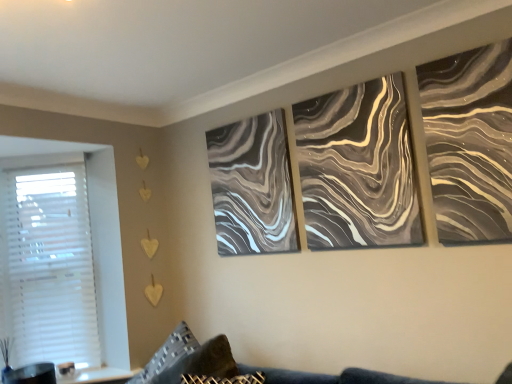
You are a GUI agent. You are given a task and a screenshot of the screen. Output one action in this format:
    pyautogui.click(x=<x>, y=<y>)
    Task: Click on the white plastic blinds at left
    
    Given the screenshot: What is the action you would take?
    pyautogui.click(x=48, y=265)

This screenshot has height=384, width=512. What do you see at coordinates (48, 265) in the screenshot?
I see `white plastic blinds at left` at bounding box center [48, 265].

Describe the element at coordinates (238, 366) in the screenshot. This screenshot has height=384, width=512. I see `velvet dark blue couch at lower center` at that location.

This screenshot has height=384, width=512. Describe the element at coordinates (470, 143) in the screenshot. I see `metallic silver abstract art at upper right` at that location.

This screenshot has width=512, height=384. I want to click on marble-like gray painting at center, which is the 1th canvas from back to front, so click(252, 187).

Considering the sizes of velvet dark blue couch at lower center and textured gray pillow at lower left in the image, is velvet dark blue couch at lower center wider or thinner than textured gray pillow at lower left?

Clearly, velvet dark blue couch at lower center has more width compared to textured gray pillow at lower left.

Between velvet dark blue couch at lower center and textured gray pillow at lower left, which one has smaller size?

textured gray pillow at lower left is smaller.

From the image's perspective, would you say velvet dark blue couch at lower center is positioned over textured gray pillow at lower left?

No, from the image's perspective, velvet dark blue couch at lower center is not above textured gray pillow at lower left.

Is point (507, 377) positioned after point (185, 348)?

No, (507, 377) is in front of (185, 348).

Who is shorter, metallic swirl canvas at center, the 2th canvas from the back, or textured gray pillow at lower left?

textured gray pillow at lower left.

From a real-world perspective, which is physically below, metallic swirl canvas at center, the 2th canvas from the back, or textured gray pillow at lower left?

textured gray pillow at lower left is physically lower.

Considering the positions of objects metallic swirl canvas at center, the second canvas positioned from the left, and textured gray pillow at lower left in the image provided, who is more to the right, metallic swirl canvas at center, the second canvas positioned from the left, or textured gray pillow at lower left?

metallic swirl canvas at center, the second canvas positioned from the left.

Could you measure the distance between metallic swirl canvas at center, the second canvas positioned from the left, and textured gray pillow at lower left?

The distance of metallic swirl canvas at center, the second canvas positioned from the left, from textured gray pillow at lower left is 1.30 meters.

Considering the relative positions of white plastic blinds at left and velvet dark blue couch at lower center in the image provided, is white plastic blinds at left to the left or to the right of velvet dark blue couch at lower center?

In the image, white plastic blinds at left appears on the left side of velvet dark blue couch at lower center.

Is white plastic blinds at left placed right next to velvet dark blue couch at lower center?

No, white plastic blinds at left is not with velvet dark blue couch at lower center.

Between white plastic blinds at left and velvet dark blue couch at lower center, which one has smaller width?

Thinner between the two is white plastic blinds at left.

Which is more to the left, velvet dark blue couch at lower center or white plastic blinds at left?

white plastic blinds at left is more to the left.

Between velvet dark blue couch at lower center and white plastic blinds at left, which one has larger width?

velvet dark blue couch at lower center.

Which object is further away from the camera taking this photo, velvet dark blue couch at lower center or white plastic blinds at left?

white plastic blinds at left.

Can you confirm if velvet dark blue couch at lower center is taller than white plastic blinds at left?

Incorrect, the height of velvet dark blue couch at lower center is not larger of that of white plastic blinds at left.

Who is more distant, white plastic blinds at left or marble-like gray painting at center, marked as the 2th canvas in a front-to-back arrangement?

white plastic blinds at left is behind.

Could marble-like gray painting at center, which is the 1th canvas from back to front, be considered to be inside white plastic blinds at left?

That's incorrect, marble-like gray painting at center, which is the 1th canvas from back to front, is not inside white plastic blinds at left.

Is white plastic blinds at left facing away from marble-like gray painting at center, which is the 1th canvas from back to front?

No, marble-like gray painting at center, which is the 1th canvas from back to front, is not at the back of white plastic blinds at left.

From the image's perspective, is white plastic blinds at left below marble-like gray painting at center, marked as the 2th canvas in a front-to-back arrangement?

Indeed, from the image's perspective, white plastic blinds at left is shown beneath marble-like gray painting at center, marked as the 2th canvas in a front-to-back arrangement.

In the image, there is a white plastic blinds at left. Where is `pillow below it (from a real-world perspective)`? Image resolution: width=512 pixels, height=384 pixels. pillow below it (from a real-world perspective) is located at coordinates (168, 354).

From the picture: Is textured gray pillow at lower left directly adjacent to white plastic blinds at left?

No, textured gray pillow at lower left is not beside white plastic blinds at left.

From a real-world perspective, is textured gray pillow at lower left under white plastic blinds at left?

Yes, from a real-world perspective, textured gray pillow at lower left is beneath white plastic blinds at left.

Which is in front, point (182, 340) or point (87, 263)?

The point (182, 340) is closer.

How many degrees apart are the facing directions of textured gray pillow at lower left and metallic swirl canvas at center, which ranks as the first canvas in right-to-left order?

There is a 0.0117-degree angle between the facing directions of textured gray pillow at lower left and metallic swirl canvas at center, which ranks as the first canvas in right-to-left order.

Are textured gray pillow at lower left and metallic swirl canvas at center, which ranks as the first canvas in right-to-left order, far apart?

Absolutely, textured gray pillow at lower left is distant from metallic swirl canvas at center, which ranks as the first canvas in right-to-left order.

In the scene shown: Is textured gray pillow at lower left to the left of metallic swirl canvas at center, the 2th canvas from the back, from the viewer's perspective?

Yes.

You are a GUI agent. You are given a task and a screenshot of the screen. Output one action in this format:
    pyautogui.click(x=<x>, y=<y>)
    Task: Click on the pillow below the metallic swirl canvas at center, the second canvas positioned from the left (from a real-world perspective)
    The height and width of the screenshot is (384, 512).
    Given the screenshot: What is the action you would take?
    pyautogui.click(x=168, y=354)

The width and height of the screenshot is (512, 384). In order to click on couch below the textured gray pillow at lower left (from a real-world perspective) in this screenshot , I will do `click(238, 366)`.

Identify the location of pillow in front of the metallic swirl canvas at center, which is the 1th canvas from front to back. (168, 354).

Based on their spatial positions, is metallic silver abstract art at upper right or metallic swirl canvas at center, which ranks as the first canvas in right-to-left order, closer to textured gray pillow at lower left?

metallic swirl canvas at center, which ranks as the first canvas in right-to-left order, is positioned closer to the anchor textured gray pillow at lower left.

When comparing their distances from white plastic blinds at left, does metallic silver abstract art at upper right or textured gray pillow at lower left seem further?

metallic silver abstract art at upper right lies further to white plastic blinds at left than the other object.

When comparing their distances from marble-like gray painting at center, marked as the 2th canvas in a right-to-left arrangement, does metallic swirl canvas at center, the 2th canvas from the back, or metallic silver abstract art at upper right seem further?

metallic silver abstract art at upper right is further to marble-like gray painting at center, marked as the 2th canvas in a right-to-left arrangement.

Considering their positions, is metallic swirl canvas at center, the second canvas positioned from the left, positioned further to textured gray pillow at lower left than marble-like gray painting at center, marked as the 2th canvas in a front-to-back arrangement?

Based on the image, metallic swirl canvas at center, the second canvas positioned from the left, appears to be further to textured gray pillow at lower left.

Estimate the real-world distances between objects in this image. Which object is further from marble-like gray painting at center, positioned as the first canvas in left-to-right order, metallic silver abstract art at upper right or metallic swirl canvas at center, the 2th canvas from the back?

metallic silver abstract art at upper right is further to marble-like gray painting at center, positioned as the first canvas in left-to-right order.

Estimate the real-world distances between objects in this image. Which object is further from white plastic blinds at left, metallic silver abstract art at upper right or velvet dark blue couch at lower center?

metallic silver abstract art at upper right is positioned further to the anchor white plastic blinds at left.

Looking at the image, which one is located further to white plastic blinds at left, marble-like gray painting at center, marked as the 2th canvas in a front-to-back arrangement, or metallic silver abstract art at upper right?

The object further to white plastic blinds at left is metallic silver abstract art at upper right.

Estimate the real-world distances between objects in this image. Which object is closer to velvet dark blue couch at lower center, metallic swirl canvas at center, the second canvas positioned from the left, or marble-like gray painting at center, marked as the 2th canvas in a right-to-left arrangement?

marble-like gray painting at center, marked as the 2th canvas in a right-to-left arrangement, is positioned closer to the anchor velvet dark blue couch at lower center.

Locate an element on the screen. Image resolution: width=512 pixels, height=384 pixels. canvas between metallic swirl canvas at center, which is the 1th canvas from front to back, and textured gray pillow at lower left vertically is located at coordinates (252, 187).

You are a GUI agent. You are given a task and a screenshot of the screen. Output one action in this format:
    pyautogui.click(x=<x>, y=<y>)
    Task: Click on the pillow between white plastic blinds at left and marble-like gray painting at center, marked as the 2th canvas in a right-to-left arrangement
    
    Given the screenshot: What is the action you would take?
    pyautogui.click(x=168, y=354)

Identify the location of pillow between velvet dark blue couch at lower center and white plastic blinds at left along the z-axis. (168, 354).

Locate an element on the screen. The image size is (512, 384). pillow situated between white plastic blinds at left and metallic swirl canvas at center, which is the 1th canvas from front to back, from left to right is located at coordinates (168, 354).